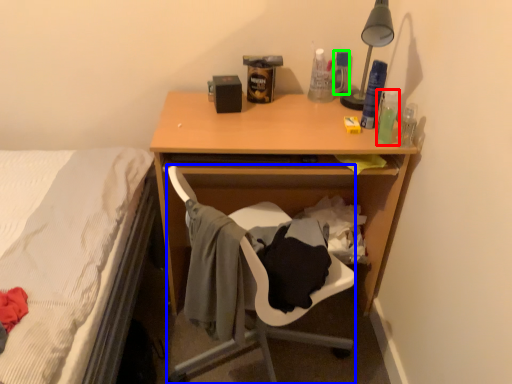
Question: Which object is positioned farthest from bottle (highlighted by a red box)? Select from chair (highlighted by a blue box) and bottle (highlighted by a green box).

Choices:
 (A) chair
 (B) bottle

Answer: (A)